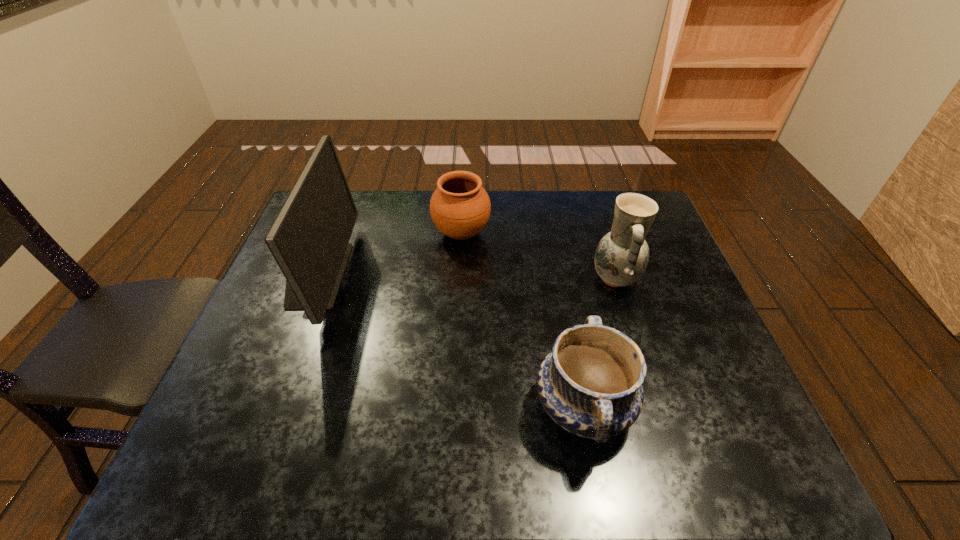
In the image, there is a desktop. Where is `vacant area at the near edge`? This screenshot has width=960, height=540. vacant area at the near edge is located at coordinates (314, 444).

The width and height of the screenshot is (960, 540). In the image, there is a desktop. What are the coordinates of `vacant area at the left edge` in the screenshot? It's located at (302, 328).

The image size is (960, 540). In order to click on vacant space at the right edge of the desktop in this screenshot , I will do `click(693, 400)`.

Locate an element on the screen. The width and height of the screenshot is (960, 540). vacant area at the far right corner of the desktop is located at coordinates (613, 202).

The image size is (960, 540). What are the coordinates of `free spot between the nearest object and the leftmost object` in the screenshot? It's located at (450, 341).

This screenshot has height=540, width=960. I want to click on free space that is in between the nearest object and the tallest object, so click(x=450, y=341).

The width and height of the screenshot is (960, 540). I want to click on free space between the nearest pottery and the farthest pottery, so click(x=522, y=320).

In order to click on vacant area between the tallest pottery and the third object from right to left in this screenshot , I will do `click(539, 256)`.

In order to click on free space between the tallest pottery and the tallest object in this screenshot , I will do `click(466, 276)`.

Locate an element on the screen. free area in between the computer monitor and the farthest pottery is located at coordinates (389, 254).